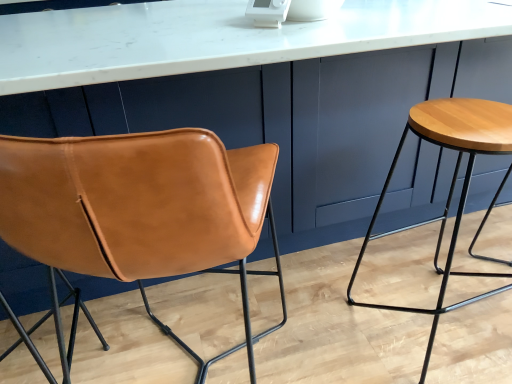
Question: Does wooden stool at right come in front of white marble countertop at center?

Choices:
 (A) yes
 (B) no

Answer: (B)

Question: Does wooden stool at right have a smaller size compared to white marble countertop at center?

Choices:
 (A) yes
 (B) no

Answer: (A)

Question: Can you confirm if wooden stool at right is wider than white marble countertop at center?

Choices:
 (A) yes
 (B) no

Answer: (B)

Question: Is the surface of wooden stool at right in direct contact with white marble countertop at center?

Choices:
 (A) yes
 (B) no

Answer: (B)

Question: From the image's perspective, is wooden stool at right located beneath white marble countertop at center?

Choices:
 (A) yes
 (B) no

Answer: (A)

Question: Is white marble countertop at center inside wooden stool at right?

Choices:
 (A) yes
 (B) no

Answer: (B)

Question: Is cognac leather chair at left positioned in front of white marble countertop at center?

Choices:
 (A) no
 (B) yes

Answer: (B)

Question: Is white marble countertop at center a part of cognac leather chair at left?

Choices:
 (A) yes
 (B) no

Answer: (B)

Question: Is cognac leather chair at left further to camera compared to white marble countertop at center?

Choices:
 (A) yes
 (B) no

Answer: (B)

Question: Considering the relative sizes of cognac leather chair at left and white marble countertop at center in the image provided, is cognac leather chair at left wider than white marble countertop at center?

Choices:
 (A) no
 (B) yes

Answer: (A)

Question: Can you confirm if cognac leather chair at left is thinner than white marble countertop at center?

Choices:
 (A) no
 (B) yes

Answer: (B)

Question: Considering the relative sizes of cognac leather chair at left and white marble countertop at center in the image provided, is cognac leather chair at left taller than white marble countertop at center?

Choices:
 (A) yes
 (B) no

Answer: (A)

Question: Does white marble countertop at center have a greater width compared to wooden stool at right?

Choices:
 (A) no
 (B) yes

Answer: (B)